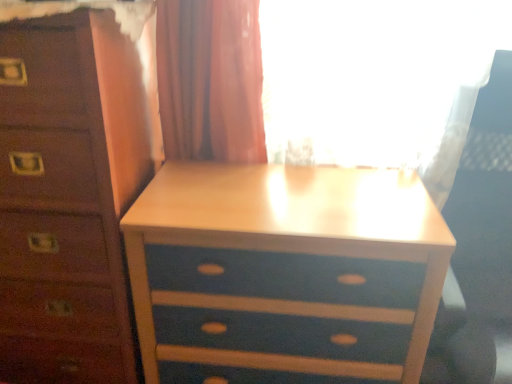
Where is `blue painted wood nightstand at center`? blue painted wood nightstand at center is located at coordinates (285, 274).

I want to click on white plastic swivel chair at right, so click(x=477, y=242).

Between white plastic swivel chair at right and blue painted wood nightstand at center, which one has less height?

blue painted wood nightstand at center.

Is white plastic swivel chair at right with blue painted wood nightstand at center?

No, white plastic swivel chair at right is not next to blue painted wood nightstand at center.

Considering the sizes of blue painted wood chest of drawers at center and blue painted wood nightstand at center in the image, is blue painted wood chest of drawers at center wider or thinner than blue painted wood nightstand at center?

blue painted wood chest of drawers at center is wider than blue painted wood nightstand at center.

Considering their positions, is blue painted wood chest of drawers at center located in front of or behind blue painted wood nightstand at center?

blue painted wood chest of drawers at center is in front of blue painted wood nightstand at center.

Based on the photo, is blue painted wood chest of drawers at center oriented away from blue painted wood nightstand at center?

No, blue painted wood chest of drawers at center is not facing away from blue painted wood nightstand at center.

Which is more to the left, blue painted wood chest of drawers at center or blue painted wood nightstand at center?

blue painted wood chest of drawers at center.

Is there a large distance between blue painted wood chest of drawers at center and white plastic swivel chair at right?

Yes, blue painted wood chest of drawers at center is far from white plastic swivel chair at right.

What's the angular difference between blue painted wood chest of drawers at center and white plastic swivel chair at right's facing directions?

They differ by 0.896 degrees in their facing directions.

Is blue painted wood chest of drawers at center positioned with its back to white plastic swivel chair at right?

No, blue painted wood chest of drawers at center is not facing away from white plastic swivel chair at right.

Between blue painted wood chest of drawers at center and white plastic swivel chair at right, which one has smaller width?

blue painted wood chest of drawers at center is thinner.

From a real-world perspective, is blue painted wood nightstand at center physically above white plastic swivel chair at right?

No.

Is blue painted wood nightstand at center oriented towards white plastic swivel chair at right?

No, blue painted wood nightstand at center is not facing towards white plastic swivel chair at right.

From the image's perspective, which one is positioned lower, blue painted wood nightstand at center or white plastic swivel chair at right?

blue painted wood nightstand at center, from the image's perspective.

Who is bigger, blue painted wood nightstand at center or white plastic swivel chair at right?

white plastic swivel chair at right.

Would you say white plastic swivel chair at right is outside blue painted wood chest of drawers at center?

Yes, white plastic swivel chair at right is located beyond the bounds of blue painted wood chest of drawers at center.

Is white plastic swivel chair at right far away from blue painted wood chest of drawers at center?

Absolutely, white plastic swivel chair at right is distant from blue painted wood chest of drawers at center.

From a real-world perspective, relative to blue painted wood chest of drawers at center, is white plastic swivel chair at right vertically above or below?

From a real-world perspective, white plastic swivel chair at right is physically below blue painted wood chest of drawers at center.

Based on the photo, is the position of white plastic swivel chair at right more distant than that of blue painted wood chest of drawers at center?

No.

From a real-world perspective, is blue painted wood nightstand at center physically below blue painted wood chest of drawers at center?

Yes, from a real-world perspective, blue painted wood nightstand at center is under blue painted wood chest of drawers at center.

Is blue painted wood nightstand at center to the right of blue painted wood chest of drawers at center from the viewer's perspective?

Indeed, blue painted wood nightstand at center is positioned on the right side of blue painted wood chest of drawers at center.

Is blue painted wood nightstand at center positioned beyond the bounds of blue painted wood chest of drawers at center?

Yes, blue painted wood nightstand at center is outside of blue painted wood chest of drawers at center.

What are the coordinates of `nightstand that appears on the left of white plastic swivel chair at right` in the screenshot? It's located at (285, 274).

Identify the location of nightstand that appears below the blue painted wood chest of drawers at center (from the image's perspective). (285, 274).

Considering their positions, is blue painted wood nightstand at center positioned further to blue painted wood chest of drawers at center than white plastic swivel chair at right?

Among the two, white plastic swivel chair at right is located further to blue painted wood chest of drawers at center.

Estimate the real-world distances between objects in this image. Which object is closer to white plastic swivel chair at right, blue painted wood chest of drawers at center or blue painted wood nightstand at center?

The object closer to white plastic swivel chair at right is blue painted wood nightstand at center.

Considering their positions, is white plastic swivel chair at right positioned further to blue painted wood nightstand at center than blue painted wood chest of drawers at center?

white plastic swivel chair at right is further to blue painted wood nightstand at center.

Based on the photo, looking at the image, which one is located closer to blue painted wood nightstand at center, blue painted wood chest of drawers at center or white plastic swivel chair at right?

Among the two, blue painted wood chest of drawers at center is located nearer to blue painted wood nightstand at center.

Looking at this image, which object lies further to the anchor point blue painted wood chest of drawers at center, white plastic swivel chair at right or blue painted wood nightstand at center?

white plastic swivel chair at right.

From the image, which object appears to be nearer to white plastic swivel chair at right, blue painted wood nightstand at center or blue painted wood chest of drawers at center?

Based on the image, blue painted wood nightstand at center appears to be nearer to white plastic swivel chair at right.

Locate an element on the screen. nightstand between blue painted wood chest of drawers at center and white plastic swivel chair at right in the horizontal direction is located at coordinates (285, 274).